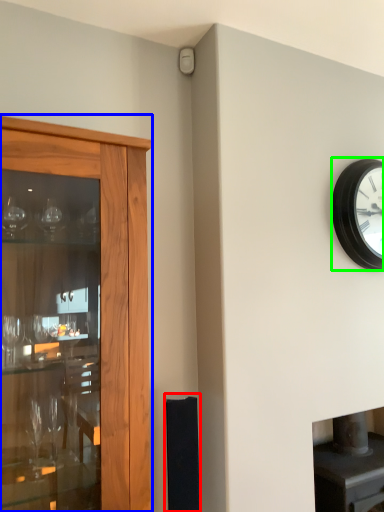
Question: Which object is the farthest from speaker (highlighted by a red box)? Choose among these: cupboard (highlighted by a blue box) or wall clock (highlighted by a green box).

Choices:
 (A) cupboard
 (B) wall clock

Answer: (B)